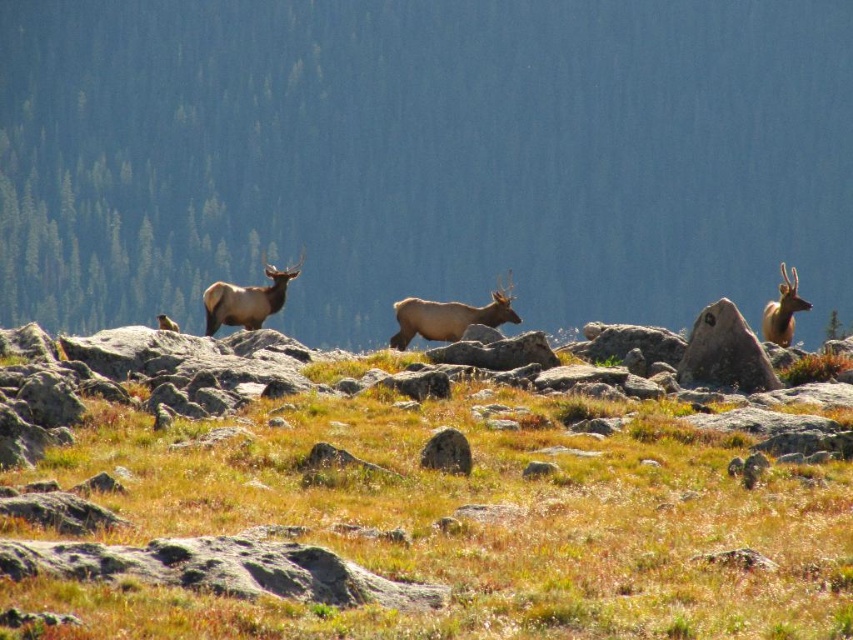
Image resolution: width=853 pixels, height=640 pixels. What do you see at coordinates (422, 156) in the screenshot?
I see `brown rocky mountain at center` at bounding box center [422, 156].

Image resolution: width=853 pixels, height=640 pixels. I want to click on brown rocky mountain at center, so click(x=422, y=156).

Who is more forward, [819,157] or [709,346]?

Positioned in front is point [709,346].

I want to click on brown rocky mountain at center, so click(x=422, y=156).

Does brown rocky mountain at center lie in front of brown grassy at center?

No, it is not.

Between brown rocky mountain at center and brown grassy at center, which one appears on the left side from the viewer's perspective?

brown grassy at center is more to the left.

Which is in front, point (378, 176) or point (285, 442)?

Positioned in front is point (285, 442).

You are a GUI agent. You are given a task and a screenshot of the screen. Output one action in this format:
    pyautogui.click(x=<x>, y=<y>)
    Task: Click on the brown rocky mountain at center
    This screenshot has height=640, width=853.
    Given the screenshot: What is the action you would take?
    pyautogui.click(x=422, y=156)

Does brown rocky mountain at center come in front of brown matte/deer at center?

That is False.

Can you confirm if brown rocky mountain at center is shorter than brown matte/deer at center?

No.

You are a GUI agent. You are given a task and a screenshot of the screen. Output one action in this format:
    pyautogui.click(x=<x>, y=<y>)
    Task: Click on the brown rocky mountain at center
    The width and height of the screenshot is (853, 640).
    Given the screenshot: What is the action you would take?
    pyautogui.click(x=422, y=156)